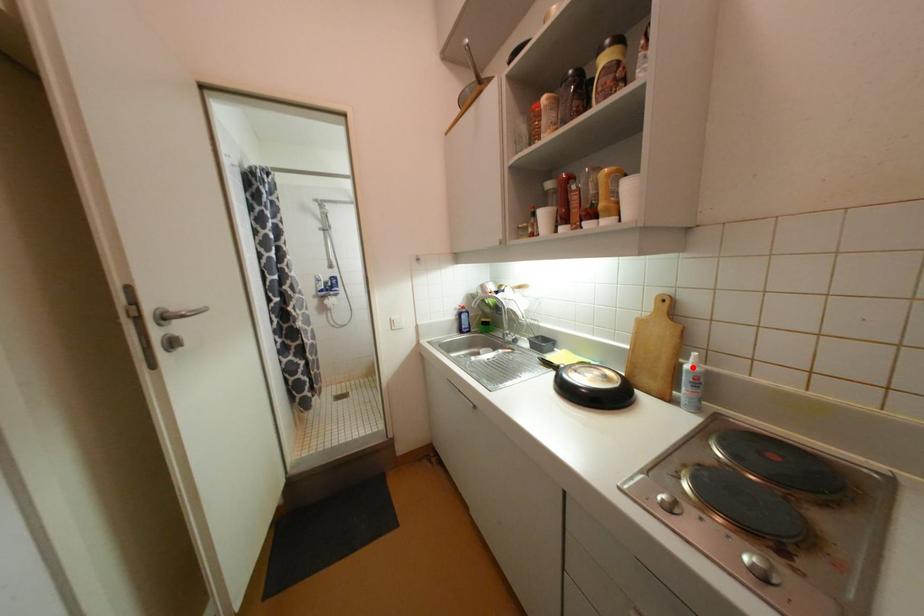
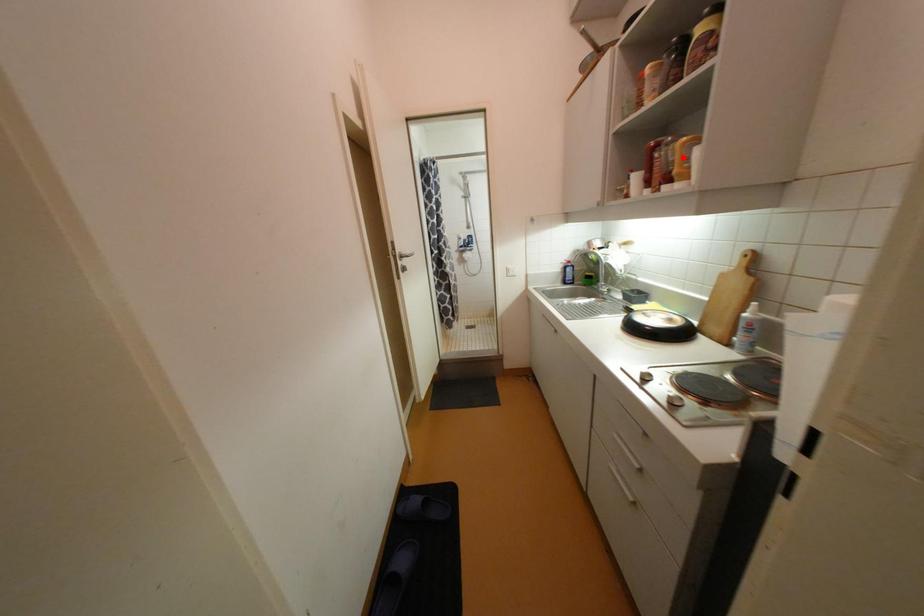
I am providing you with two images of the same scene from different viewpoints. A red point is marked on the first image and another point is marked on the second image. Do the highlighted points in image1 and image2 indicate the same real-world spot?

No